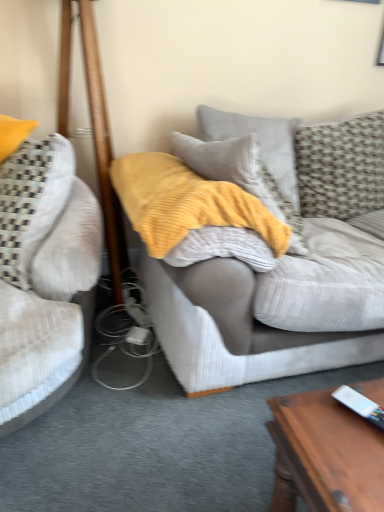
What do you see at coordinates (185, 203) in the screenshot? The image size is (384, 512). I see `yellow textured blanket at center` at bounding box center [185, 203].

Locate an element on the screen. This screenshot has width=384, height=512. textured gray couch at center, the first studio couch when ordered from right to left is located at coordinates (286, 280).

The width and height of the screenshot is (384, 512). What do you see at coordinates (341, 167) in the screenshot? I see `textured beige pillow at upper right, which ranks as the second pillow in left-to-right order` at bounding box center [341, 167].

You are a GUI agent. You are given a task and a screenshot of the screen. Output one action in this format:
    pyautogui.click(x=<x>, y=<y>)
    Task: Click on the wooden pole at left
    
    Given the screenshot: What is the action you would take?
    click(103, 150)

In order to click on textured gray pillow at upper right, placed as the second pillow when sorted from right to left in this screenshot , I will do `click(259, 142)`.

Describe the element at coordinates (259, 142) in the screenshot. I see `textured gray pillow at upper right, placed as the second pillow when sorted from right to left` at that location.

Where is `white plastic remote control at lower right`? The image size is (384, 512). white plastic remote control at lower right is located at coordinates (360, 405).

Locate an element on the screen. yellow textured blanket at center is located at coordinates (185, 203).

Is textured beige pillow at upper right, which ranks as the second pillow in left-to-right order, beside textured gray couch at center, which is the 2th studio couch in left-to-right order?

textured beige pillow at upper right, which ranks as the second pillow in left-to-right order, and textured gray couch at center, which is the 2th studio couch in left-to-right order, are not in contact.

Considering the relative positions of textured beige pillow at upper right, which ranks as the second pillow in left-to-right order, and textured gray couch at center, the first studio couch when ordered from right to left, in the image provided, is textured beige pillow at upper right, which ranks as the second pillow in left-to-right order, to the right of textured gray couch at center, the first studio couch when ordered from right to left, from the viewer's perspective?

Yes.

From a real-world perspective, between textured beige pillow at upper right, the first pillow when ordered from right to left, and textured gray couch at center, the first studio couch when ordered from right to left, who is vertically lower?

textured beige pillow at upper right, the first pillow when ordered from right to left, is physically lower.

How many degrees apart are the facing directions of yellow textured blanket at center and white plastic remote control at lower right?

→ 155 degrees separate the facing orientations of yellow textured blanket at center and white plastic remote control at lower right.

Who is bigger, yellow textured blanket at center or white plastic remote control at lower right?

With larger size is yellow textured blanket at center.

Which object is further away from the camera taking this photo, yellow textured blanket at center or white plastic remote control at lower right?

yellow textured blanket at center.

Is yellow textured blanket at center oriented towards white plastic remote control at lower right?

Yes, yellow textured blanket at center is turned towards white plastic remote control at lower right.

How different are the orientations of textured gray couch at center, the first studio couch when ordered from right to left, and wooden pole at left in degrees?

There is a 12.9-degree angle between the facing directions of textured gray couch at center, the first studio couch when ordered from right to left, and wooden pole at left.

Is textured gray couch at center, which is the 2th studio couch in left-to-right order, completely or partially outside of wooden pole at left?

Indeed, textured gray couch at center, which is the 2th studio couch in left-to-right order, is completely outside wooden pole at left.

Based on their positions, is textured gray couch at center, the first studio couch when ordered from right to left, located to the left or right of wooden pole at left?

Based on their positions, textured gray couch at center, the first studio couch when ordered from right to left, is located to the right of wooden pole at left.

The height and width of the screenshot is (512, 384). Identify the location of studio couch that is the 1st one when counting downward from the wooden pole at left (from the image's perspective). (286, 280).

Does velvet beige couch at left, which is the 2th studio couch from right to left, turn towards wooden pole at left?

No, velvet beige couch at left, which is the 2th studio couch from right to left, does not turn towards wooden pole at left.

Is velvet beige couch at left, the 1th studio couch when ordered from left to right, positioned beyond the bounds of wooden pole at left?

That's correct, velvet beige couch at left, the 1th studio couch when ordered from left to right, is outside of wooden pole at left.

Does velvet beige couch at left, which is the 2th studio couch from right to left, lie in front of wooden pole at left?

Yes.

Does point (25, 274) come behind point (58, 124)?

No.

Is yellow textured blanket at center inside textured gray couch at center, the first studio couch when ordered from right to left?

Absolutely, yellow textured blanket at center is inside textured gray couch at center, the first studio couch when ordered from right to left.

What's the angular difference between textured gray couch at center, which is the 2th studio couch in left-to-right order, and yellow textured blanket at center's facing directions?

The angular difference between textured gray couch at center, which is the 2th studio couch in left-to-right order, and yellow textured blanket at center is 15 degrees.

In the scene shown: Who is shorter, textured gray couch at center, which is the 2th studio couch in left-to-right order, or yellow textured blanket at center?

yellow textured blanket at center.

Looking at this image, which object is closer to the camera taking this photo, textured gray couch at center, which is the 2th studio couch in left-to-right order, or yellow textured blanket at center?

yellow textured blanket at center is in front.

Is velvet beige couch at left, which is the 2th studio couch from right to left, not close to textured gray pillow at upper right, acting as the 1th pillow starting from the left?

No, there isn't a large distance between velvet beige couch at left, which is the 2th studio couch from right to left, and textured gray pillow at upper right, acting as the 1th pillow starting from the left.

Is velvet beige couch at left, the 1th studio couch when ordered from left to right, situated inside textured gray pillow at upper right, acting as the 1th pillow starting from the left, or outside?

velvet beige couch at left, the 1th studio couch when ordered from left to right, is not enclosed by textured gray pillow at upper right, acting as the 1th pillow starting from the left.

Considering the relative sizes of velvet beige couch at left, the 1th studio couch when ordered from left to right, and textured gray pillow at upper right, acting as the 1th pillow starting from the left, in the image provided, is velvet beige couch at left, the 1th studio couch when ordered from left to right, shorter than textured gray pillow at upper right, acting as the 1th pillow starting from the left,?

In fact, velvet beige couch at left, the 1th studio couch when ordered from left to right, may be taller than textured gray pillow at upper right, acting as the 1th pillow starting from the left.

From a real-world perspective, is white plastic remote control at lower right physically below yellow textured blanket at center?

Yes, from a real-world perspective, white plastic remote control at lower right is beneath yellow textured blanket at center.

Which object is further away from the camera taking this photo, white plastic remote control at lower right or yellow textured blanket at center?

yellow textured blanket at center is further away from the camera.

Who is taller, white plastic remote control at lower right or yellow textured blanket at center?

yellow textured blanket at center.

From the image's perspective, does white plastic remote control at lower right appear lower than yellow textured blanket at center?

Yes, from the image's perspective, white plastic remote control at lower right is beneath yellow textured blanket at center.

The width and height of the screenshot is (384, 512). What are the coordinates of `the 1st pillow positioned above the textured gray couch at center, the first studio couch when ordered from right to left (from the image's perspective)` in the screenshot? It's located at (341, 167).

Locate an element on the screen. ipod beneath the yellow textured blanket at center (from a real-world perspective) is located at coordinates (360, 405).

Which object lies nearer to the anchor point textured gray couch at center, which is the 2th studio couch in left-to-right order, white plastic remote control at lower right or textured gray pillow at upper right, acting as the 1th pillow starting from the left?

textured gray pillow at upper right, acting as the 1th pillow starting from the left, is closer to textured gray couch at center, which is the 2th studio couch in left-to-right order.

Estimate the real-world distances between objects in this image. Which object is further from yellow textured blanket at center, white plastic remote control at lower right or wooden pole at left?

white plastic remote control at lower right is further to yellow textured blanket at center.

Which object lies nearer to the anchor point velvet beige couch at left, which is the 2th studio couch from right to left, white plastic remote control at lower right or textured gray couch at center, which is the 2th studio couch in left-to-right order?

The object closer to velvet beige couch at left, which is the 2th studio couch from right to left, is textured gray couch at center, which is the 2th studio couch in left-to-right order.

Based on their spatial positions, is wooden pole at left or velvet beige couch at left, which is the 2th studio couch from right to left, closer to yellow textured blanket at center?

Based on the image, velvet beige couch at left, which is the 2th studio couch from right to left, appears to be nearer to yellow textured blanket at center.

When comparing their distances from white plastic remote control at lower right, does yellow textured blanket at center or wooden pole at left seem further?

Based on the image, wooden pole at left appears to be further to white plastic remote control at lower right.

Which object lies further to the anchor point textured beige pillow at upper right, the first pillow when ordered from right to left, white plastic remote control at lower right or velvet beige couch at left, which is the 2th studio couch from right to left?

white plastic remote control at lower right is positioned further to the anchor textured beige pillow at upper right, the first pillow when ordered from right to left.

Looking at the image, which one is located further to textured gray couch at center, which is the 2th studio couch in left-to-right order, textured beige pillow at upper right, the first pillow when ordered from right to left, or yellow textured blanket at center?

Based on the image, yellow textured blanket at center appears to be further to textured gray couch at center, which is the 2th studio couch in left-to-right order.

Considering their positions, is velvet beige couch at left, the 1th studio couch when ordered from left to right, positioned further to yellow textured blanket at center than textured gray pillow at upper right, placed as the second pillow when sorted from right to left?

textured gray pillow at upper right, placed as the second pillow when sorted from right to left.

Find the location of a particular element. This screenshot has width=384, height=512. studio couch between yellow textured blanket at center and textured beige pillow at upper right, which ranks as the second pillow in left-to-right order is located at coordinates (286, 280).

Locate an element on the screen. The image size is (384, 512). studio couch between velvet beige couch at left, which is the 2th studio couch from right to left, and textured gray pillow at upper right, placed as the second pillow when sorted from right to left, in the horizontal direction is located at coordinates (286, 280).

The image size is (384, 512). I want to click on pillow located between velvet beige couch at left, the 1th studio couch when ordered from left to right, and textured beige pillow at upper right, the first pillow when ordered from right to left, in the left-right direction, so click(x=259, y=142).

At what (x,y) coordinates should I click in order to perform the action: click on studio couch located between wooden pole at left and textured beige pillow at upper right, which ranks as the second pillow in left-to-right order, in the left-right direction. Please return your answer as a coordinate pair (x, y). The image size is (384, 512). Looking at the image, I should click on (286, 280).